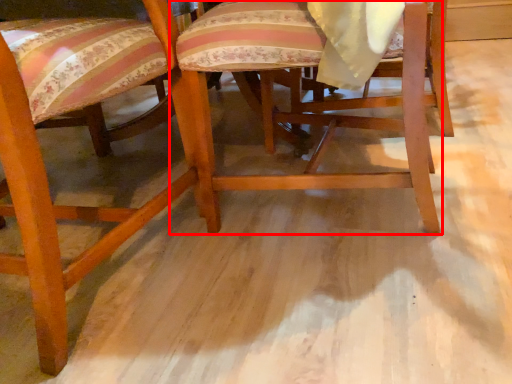
Question: From the image's perspective, where is chair (annotated by the red box) located relative to chair?

Choices:
 (A) below
 (B) above

Answer: (B)